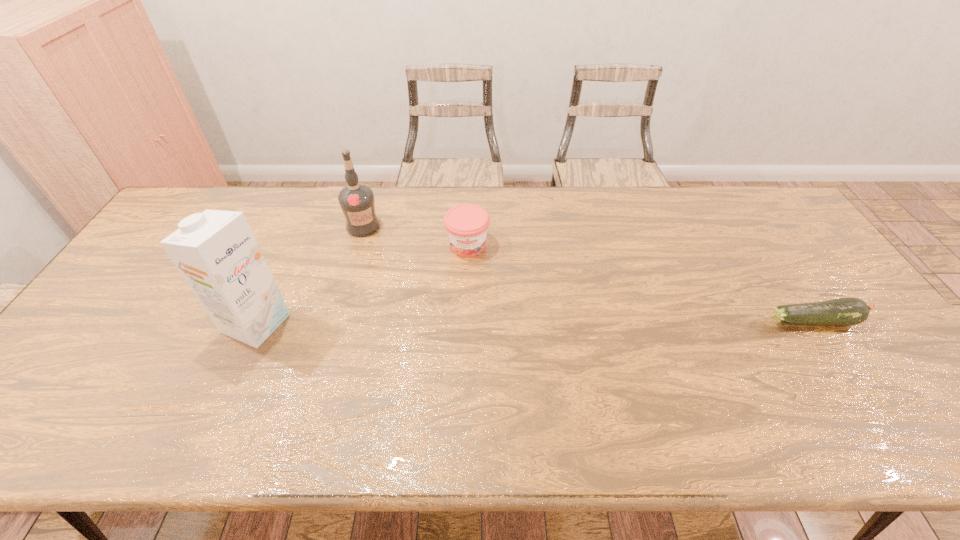
At what (x,y) coordinates should I click in order to perform the action: click on vacant space at the right edge of the desktop. Please return your answer as a coordinate pair (x, y). This screenshot has height=540, width=960. Looking at the image, I should click on (807, 251).

At what (x,y) coordinates should I click in order to perform the action: click on free space at the far right corner of the desktop. Please return your answer as a coordinate pair (x, y). The height and width of the screenshot is (540, 960). Looking at the image, I should click on (x=758, y=214).

You are a GUI agent. You are given a task and a screenshot of the screen. Output one action in this format:
    pyautogui.click(x=<x>, y=<y>)
    Task: Click on the vacant space that's between the leftmost object and the vodka
    This screenshot has width=960, height=540.
    Given the screenshot: What is the action you would take?
    pyautogui.click(x=310, y=275)

You are a GUI agent. You are given a task and a screenshot of the screen. Output one action in this format:
    pyautogui.click(x=<x>, y=<y>)
    Task: Click on the empty space between the second tallest object and the leftmost object
    The image size is (960, 540).
    Given the screenshot: What is the action you would take?
    pyautogui.click(x=310, y=275)

Find the location of `blank region between the jam and the tallest object`. blank region between the jam and the tallest object is located at coordinates (362, 284).

You are a GUI agent. You are given a task and a screenshot of the screen. Output one action in this format:
    pyautogui.click(x=<x>, y=<y>)
    Task: Click on the free area in between the shortest object and the third tallest object
    
    Given the screenshot: What is the action you would take?
    pyautogui.click(x=640, y=283)

Where is `free space between the shortest object and the tallest object`? free space between the shortest object and the tallest object is located at coordinates (535, 322).

Find the location of a particular element. empty location between the leftmost object and the vodka is located at coordinates (310, 275).

This screenshot has width=960, height=540. In order to click on free space between the shortest object and the vodka in this screenshot , I will do `click(588, 273)`.

The width and height of the screenshot is (960, 540). I want to click on vacant space that's between the third tallest object and the third object from right to left, so click(x=416, y=236).